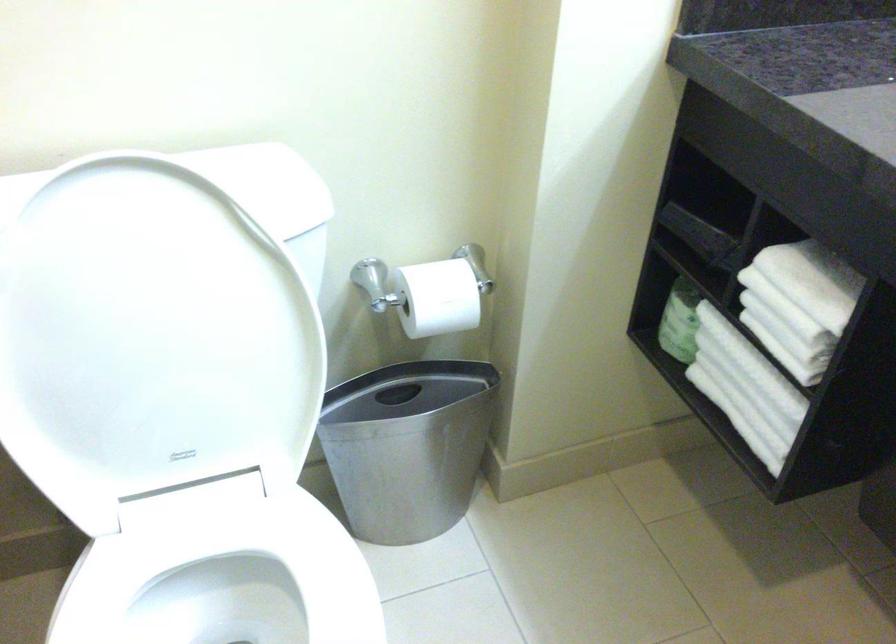
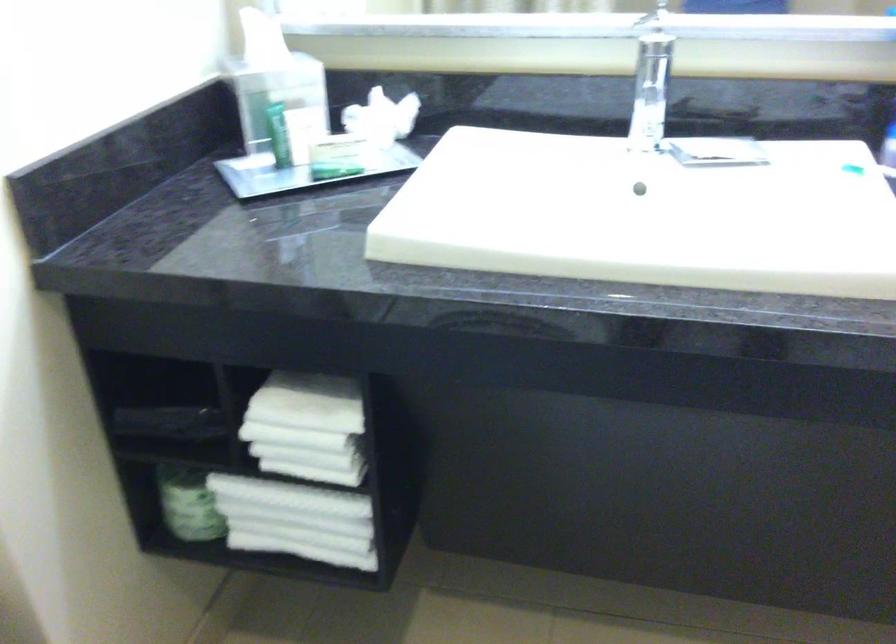
Question: How did the camera likely rotate?

Choices:
 (A) Left
 (B) Right
 (C) Up
 (D) Down

Answer: (B)